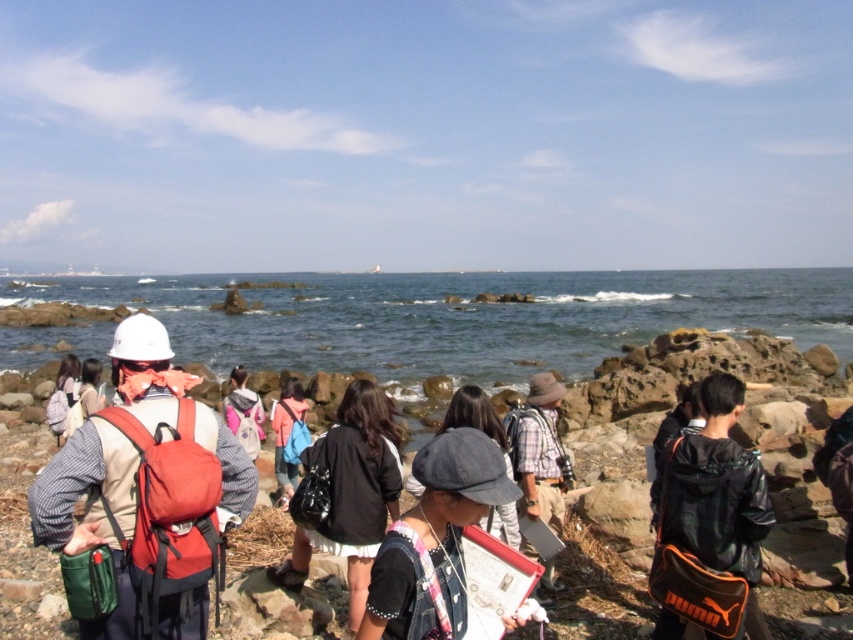
Question: Among these objects, which one is nearest to the camera?

Choices:
 (A) clear blue water at center
 (B) leather jacket at center

Answer: (B)

Question: Is denim hat at center above black matte jacket at center?

Choices:
 (A) no
 (B) yes

Answer: (B)

Question: From the image, what is the correct spatial relationship of clear blue water at center in relation to leather jacket at center?

Choices:
 (A) left
 (B) right

Answer: (B)

Question: Is matte white helmet at left smaller than denim hat at center?

Choices:
 (A) no
 (B) yes

Answer: (A)

Question: Which object appears farthest from the camera in this image?

Choices:
 (A) leather jacket at center
 (B) denim hat at center
 (C) clear blue water at center
 (D) matte white helmet at left

Answer: (C)

Question: Estimate the real-world distances between objects in this image. Which object is farther from the denim hat at center?

Choices:
 (A) leather jacket at center
 (B) matte white helmet at left
 (C) black matte jacket at center
 (D) clear blue water at center

Answer: (D)